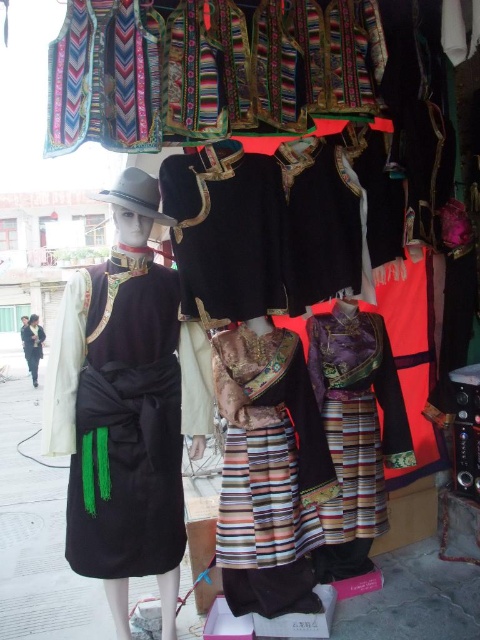
You are standing in front of a display of traditional clothing at a market. There are two points marked on the display, one at coordinates point (167, 440) and another at point (250, 552). Which of these two points is closer to you?

Point (167, 440) is closer to the viewer than point (250, 552).

You are a fashion designer who wants to create a new outfit combining the velvet striped skirt at center and the purple satin dress at center. Which garment should you place first to ensure the combination looks balanced?

The velvet striped skirt at center might be wider than purple satin dress at center, so placing the purple satin dress at center first would allow the wider skirt to create a balanced look.